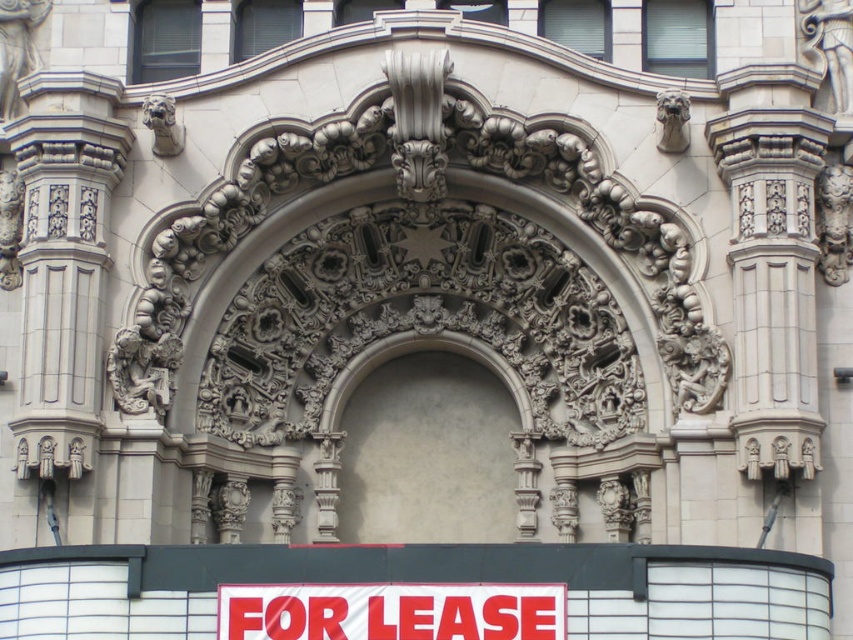
Question: Among these objects, which one is nearest to the camera?

Choices:
 (A) white plastic sign at center
 (B) smooth beige arch at center

Answer: (A)

Question: Is the position of smooth beige arch at center more distant than that of white plastic sign at center?

Choices:
 (A) yes
 (B) no

Answer: (A)

Question: Considering the relative positions of smooth beige arch at center and white plastic sign at center in the image provided, where is smooth beige arch at center located with respect to white plastic sign at center?

Choices:
 (A) above
 (B) below

Answer: (A)

Question: Does smooth beige arch at center have a larger size compared to white plastic sign at center?

Choices:
 (A) yes
 (B) no

Answer: (A)

Question: Which point is farther from the camera taking this photo?

Choices:
 (A) (512, 584)
 (B) (445, 403)

Answer: (B)